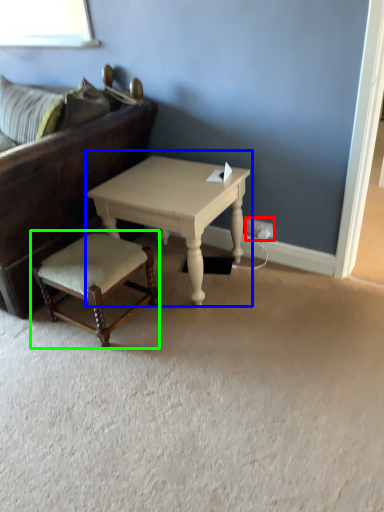
Question: Which object is positioned farthest from electric outlet (highlighted by a red box)? Select from coffee table (highlighted by a blue box) and stool (highlighted by a green box).

Choices:
 (A) coffee table
 (B) stool

Answer: (B)